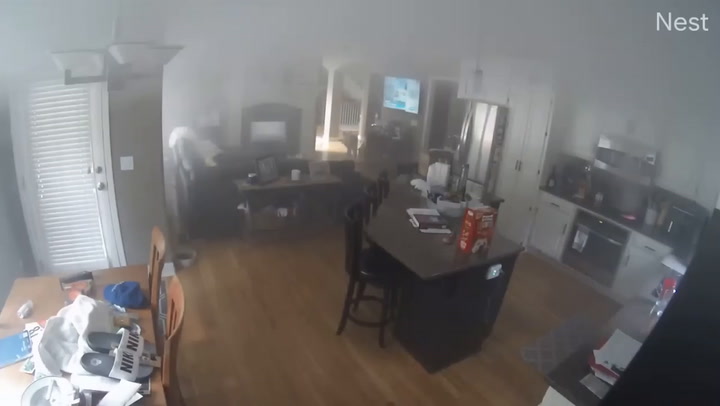
I want to click on door, so click(84, 212).